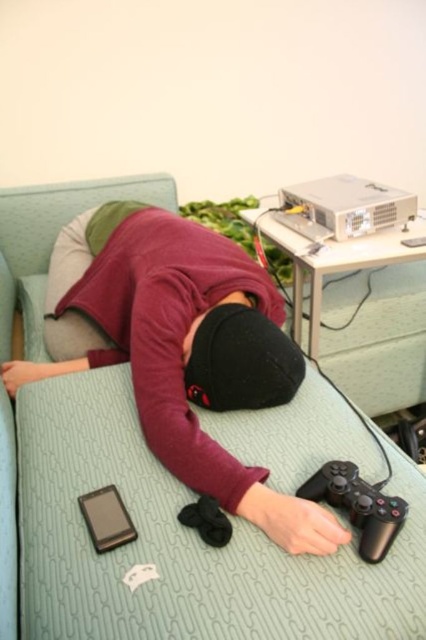
Based on the photo, you are a photographer who wants to take a closeup shot of the green fabric bed at center. You have a camera that requires a minimum distance of 30 inches to focus properly. Can you take the photo without moving the camera or the bed?

The green fabric bed at center and camera are 29.36 inches apart from each other. Since the minimum focusing distance is 30 inches, the camera cannot focus properly at 29.36 inches. Therefore, you cannot take the photo without moving the camera or the bed.

You are a delivery robot in the room. You need to place a small package on the green fabric bed at center and the black matte game controller at lower right. Which object should you place the package on first to avoid blocking the controller?

The green fabric bed at center is in front of the black matte game controller at lower right, so you should place the package on the green fabric bed at center first to avoid blocking the controller.

You are a delivery robot trying to place a small package on the sofa. The package is as wide as the black matte smartphone at lower left. Can you place it on the green fabric bed at center without overlapping the existing items?

The green fabric bed at center is wider than the black matte smartphone at lower left, so the package can fit on the green fabric bed at center as long as there is enough space not occupied by existing items.